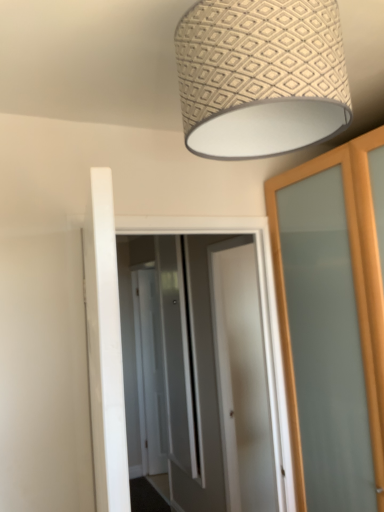
Question: Is patterned fabric lampshade at upper center in front of or behind white glossy door at center, the 3th screen door when ordered from back to front, in the image?

Choices:
 (A) behind
 (B) front

Answer: (B)

Question: Is patterned fabric lampshade at upper center bigger or smaller than white glossy door at center, the 3th screen door when ordered from back to front?

Choices:
 (A) big
 (B) small

Answer: (B)

Question: Which object is positioned closest to the white glossy door at center, acting as the first screen door starting from the back?

Choices:
 (A) clear glass screen door at center, which is the 2th screen door from front to back
 (B) white glossy door at center
 (C) patterned fabric lampshade at upper center
 (D) white glossy door at center, the 3th screen door when ordered from back to front

Answer: (D)

Question: Estimate the real-world distances between objects in this image. Which object is farther from the patterned fabric lampshade at upper center?

Choices:
 (A) white glossy door at center, acting as the first screen door starting from the back
 (B) white glossy door at center, the 3th screen door when ordered from back to front
 (C) white glossy door at center
 (D) clear glass screen door at center, which is the 2th screen door from front to back

Answer: (A)